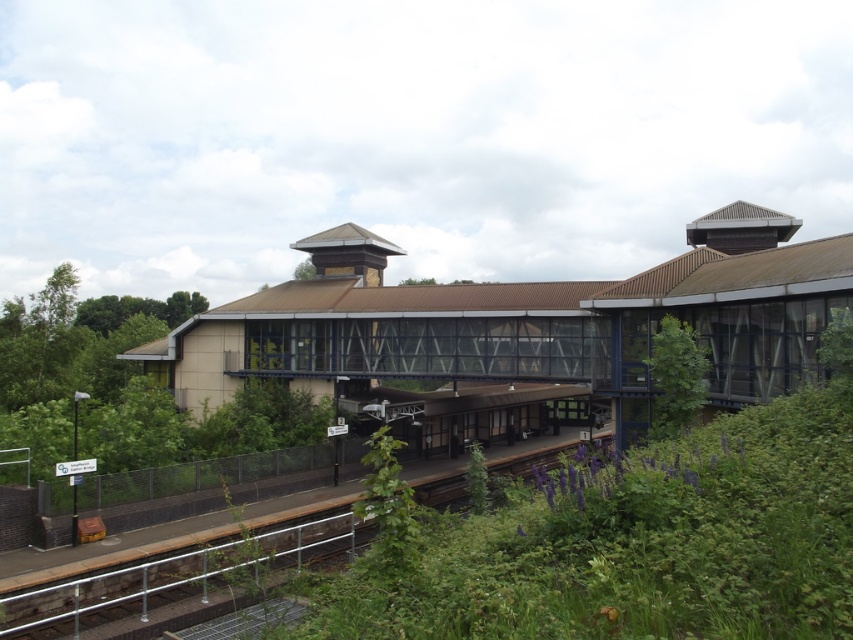
Between brown textured building at center and metallic rail at lower center, which one is positioned lower?

Positioned lower is metallic rail at lower center.

Is the position of brown textured building at center less distant than that of metallic rail at lower center?

No.

Where is `brown textured building at center`? brown textured building at center is located at coordinates (525, 321).